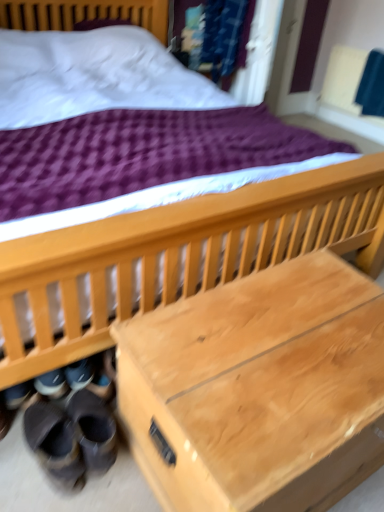
Question: Does natural wood trunk at lower center have a smaller size compared to leather brown shoes at lower left?

Choices:
 (A) yes
 (B) no

Answer: (B)

Question: Does natural wood trunk at lower center touch leather brown shoes at lower left?

Choices:
 (A) no
 (B) yes

Answer: (A)

Question: Is leather brown shoes at lower left at the back of natural wood trunk at lower center?

Choices:
 (A) no
 (B) yes

Answer: (A)

Question: Considering the relative sizes of natural wood trunk at lower center and leather brown shoes at lower left in the image provided, is natural wood trunk at lower center shorter than leather brown shoes at lower left?

Choices:
 (A) yes
 (B) no

Answer: (B)

Question: From the image's perspective, is natural wood trunk at lower center on leather brown shoes at lower left?

Choices:
 (A) no
 (B) yes

Answer: (B)

Question: From a real-world perspective, is natural wood trunk at lower center physically located above or below black suede shoes at lower left, the first footwear from the right?

Choices:
 (A) below
 (B) above

Answer: (B)

Question: In terms of size, does natural wood trunk at lower center appear bigger or smaller than black suede shoes at lower left, the first footwear from the right?

Choices:
 (A) big
 (B) small

Answer: (A)

Question: Is natural wood trunk at lower center in front of or behind black suede shoes at lower left, the first footwear from the right, in the image?

Choices:
 (A) behind
 (B) front

Answer: (B)

Question: Does point (132, 329) appear closer or farther from the camera than point (94, 441)?

Choices:
 (A) farther
 (B) closer

Answer: (B)

Question: Which is correct: leather-like brown shoes at lower left, which ranks as the 2th footwear in right-to-left order, is inside natural wood trunk at lower center, or outside of it?

Choices:
 (A) outside
 (B) inside

Answer: (A)

Question: Is leather-like brown shoes at lower left, which is the first footwear in left-to-right order, taller or shorter than natural wood trunk at lower center?

Choices:
 (A) tall
 (B) short

Answer: (B)

Question: From the image's perspective, is leather-like brown shoes at lower left, which is the first footwear in left-to-right order, above or below natural wood trunk at lower center?

Choices:
 (A) below
 (B) above

Answer: (A)

Question: In terms of size, does leather-like brown shoes at lower left, which is the first footwear in left-to-right order, appear bigger or smaller than natural wood trunk at lower center?

Choices:
 (A) big
 (B) small

Answer: (B)

Question: From a real-world perspective, is leather brown shoes at lower left positioned above or below natural wood trunk at lower center?

Choices:
 (A) below
 (B) above

Answer: (A)

Question: Is leather brown shoes at lower left spatially inside natural wood trunk at lower center, or outside of it?

Choices:
 (A) inside
 (B) outside

Answer: (B)